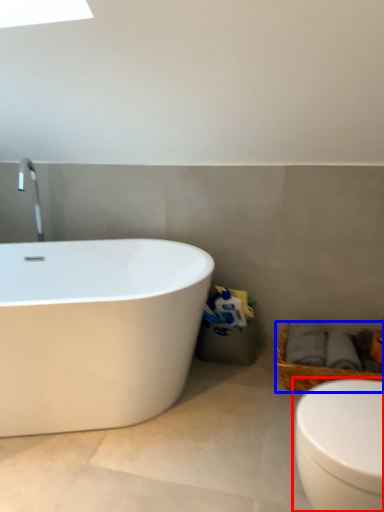
Question: Which object is further to the camera taking this photo, toilet (highlighted by a red box) or basket (highlighted by a blue box)?

Choices:
 (A) toilet
 (B) basket

Answer: (B)